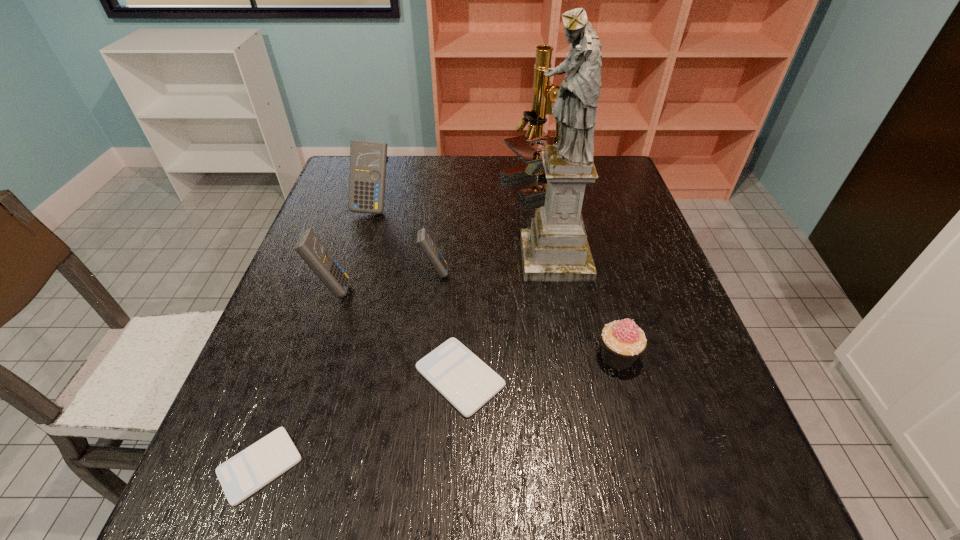
I want to click on object that can be found as the third closest to the farthest blue calculator, so click(544, 92).

What are the coordinates of `object that ranks as the third closest to the fourth shortest calculator` in the screenshot? It's located at (367, 176).

The width and height of the screenshot is (960, 540). What are the coordinates of `calculator that is the closest to the microscope` in the screenshot? It's located at point(424,240).

Find the location of a particular element. Image resolution: width=960 pixels, height=540 pixels. calculator that stands as the closest to the gold microscope is located at coordinates (424, 240).

Find the location of `blue calculator that can be found as the second closest to the tallest calculator`. blue calculator that can be found as the second closest to the tallest calculator is located at coordinates (309, 247).

At what (x,y) coordinates should I click in order to perform the action: click on the closest blue calculator to the bigger white calculator. Please return your answer as a coordinate pair (x, y). This screenshot has height=540, width=960. Looking at the image, I should click on (424, 240).

Where is `free space that satisfies the following two spatial constraints: 1. on the front-facing side of the tallest calculator; 2. on the front-facing side of the fourth tallest object`? This screenshot has width=960, height=540. free space that satisfies the following two spatial constraints: 1. on the front-facing side of the tallest calculator; 2. on the front-facing side of the fourth tallest object is located at coordinates (349, 289).

Identify the location of free space that satisfies the following two spatial constraints: 1. on the front-facing side of the farther white calculator; 2. on the left side of the third shortest calculator. (423, 377).

Locate an element on the screen. vacant region that satisfies the following two spatial constraints: 1. at the eyepiece of the seventh shortest object; 2. on the front-facing side of the biggest blue calculator is located at coordinates (546, 207).

Image resolution: width=960 pixels, height=540 pixels. What are the coordinates of `free location that satisfies the following two spatial constraints: 1. on the front-facing side of the right white calculator; 2. on the right side of the second tallest calculator` in the screenshot? It's located at (302, 377).